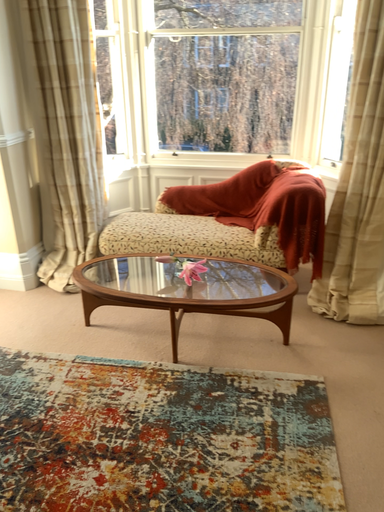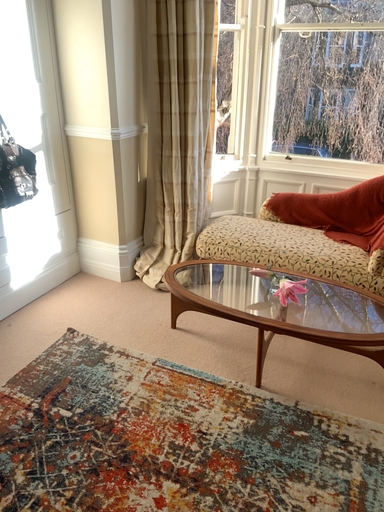
Question: Which way did the camera rotate in the video?

Choices:
 (A) rotated right
 (B) rotated left

Answer: (B)